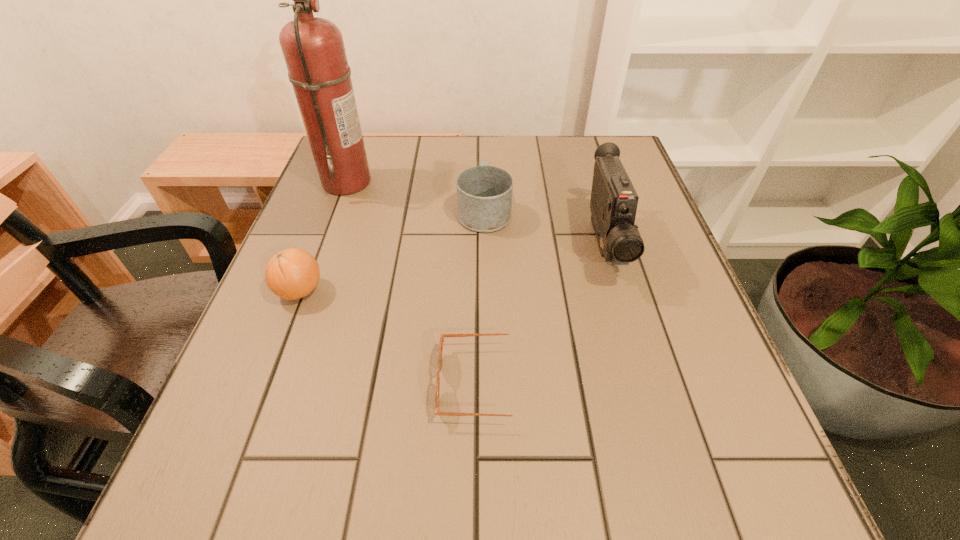
The height and width of the screenshot is (540, 960). I want to click on blank region between the nearest object and the mug, so coord(485,297).

In order to click on free space between the camcorder and the orange in this screenshot , I will do `click(452, 268)`.

I want to click on free space between the fire extinguisher and the mug, so click(x=416, y=196).

You are a GUI agent. You are given a task and a screenshot of the screen. Output one action in this format:
    pyautogui.click(x=<x>, y=<y>)
    Task: Click on the blank region between the nearest object and the fire extinguisher
    
    Given the screenshot: What is the action you would take?
    pyautogui.click(x=416, y=282)

At what (x,y) coordinates should I click in order to perform the action: click on free space between the sunglasses and the mug. Please return your answer as a coordinate pair (x, y). The height and width of the screenshot is (540, 960). Looking at the image, I should click on (485, 297).

At what (x,y) coordinates should I click in order to perform the action: click on vacant region between the rightmost object and the sunglasses. Please return your answer as a coordinate pair (x, y). This screenshot has height=540, width=960. Looking at the image, I should click on (544, 314).

Identify which object is located as the nearest to the orange. Please provide its 2D coordinates. Your answer should be formatted as a tuple, i.e. [(x, y)], where the tuple contains the x and y coordinates of a point satisfying the conditions above.

[(313, 48)]

Identify the location of object that is the second closest to the sunglasses. click(293, 273).